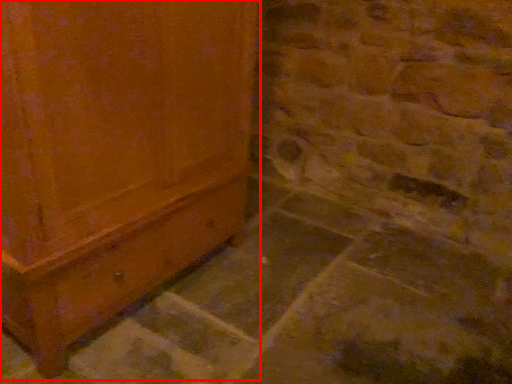
Question: Observing the image, what is the correct spatial positioning of furniture (annotated by the red box) in reference to concrete?

Choices:
 (A) right
 (B) left

Answer: (B)